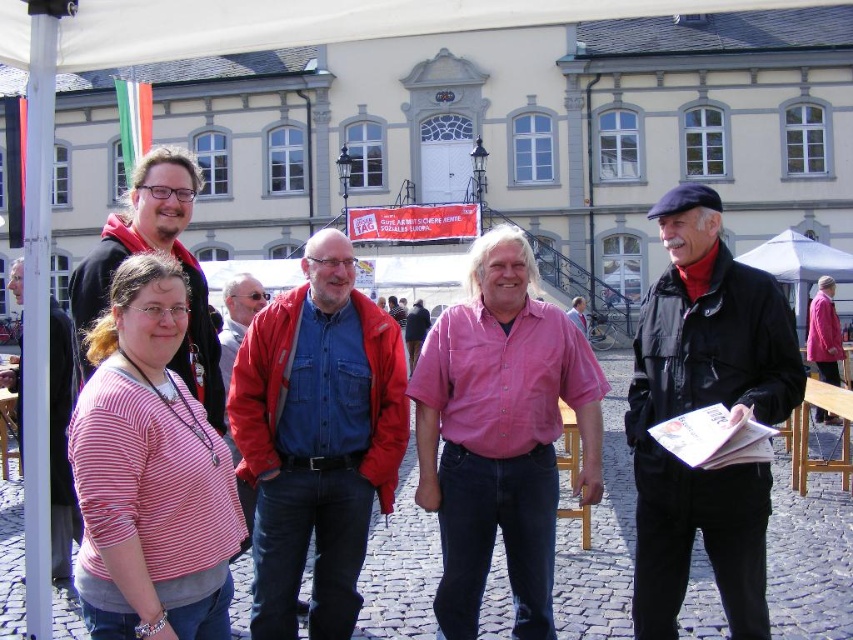
Question: Does red denim jacket at center have a larger size compared to pink striped shirt at left?

Choices:
 (A) yes
 (B) no

Answer: (B)

Question: Is red denim jacket at center smaller than matte black jacket at left?

Choices:
 (A) no
 (B) yes

Answer: (B)

Question: Does red denim jacket at center come in front of matte black jacket at left?

Choices:
 (A) no
 (B) yes

Answer: (A)

Question: Which point is farther to the camera?

Choices:
 (A) black leather jacket at right
 (B) matte black jacket at left
 (C) pink striped shirt at left

Answer: (B)

Question: Which point appears farthest from the camera in this image?

Choices:
 (A) (572, 401)
 (B) (57, 547)

Answer: (A)

Question: Which point is closer to the camera?

Choices:
 (A) (485, 276)
 (B) (323, 300)
 (C) (683, 410)

Answer: (C)